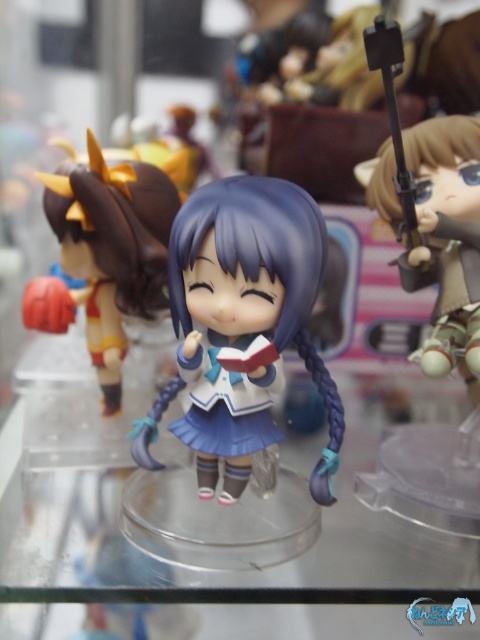
You are observing the glass shelf with the anime figurines. There are two points marked on the shelf at coordinates point (x=425, y=545) and point (x=72, y=305). If you want to place a new figurine closer to the camera, which point should you choose?

You should choose point (x=425, y=545) because it is closer to the camera than point (x=72, y=305).

You are standing 1.5 meters away from the camera. Which object is closer to you between the two figurines and the point at (379,413)?

The point at (379,413) is closer to you because it is only 1.30 meters away from the camera, while you are 1.5 meters away from the camera, making the distance between you and the point 0.2 meters.

You are a collector who wants to place a new figurine on the shelf. The new figurine is 15 cm wide. You see the transparent plastic glass table at center and the satin blue dress at center. Which object should you place the new figurine next to to ensure it fits?

The transparent plastic glass table at center has a larger width than the satin blue dress at center, so placing the new figurine next to the transparent plastic glass table at center would provide more space for the 15 cm wide figurine to fit comfortably.